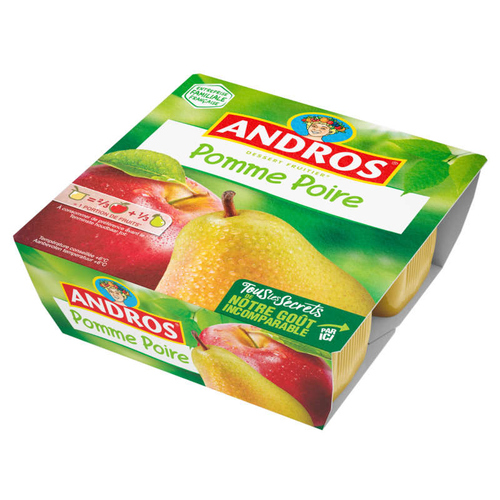
At what (x,y) coordinates should I click in order to perform the action: click on plastic containers. Please return your answer as a coordinate pair (x, y). The width and height of the screenshot is (500, 500). Looking at the image, I should click on (408, 279), (349, 351).